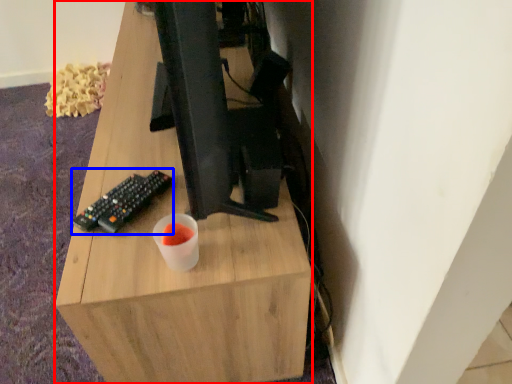
Question: Among these objects, which one is nearest to the camera, desk (highlighted by a red box) or computer keyboard (highlighted by a blue box)?

Choices:
 (A) desk
 (B) computer keyboard

Answer: (A)